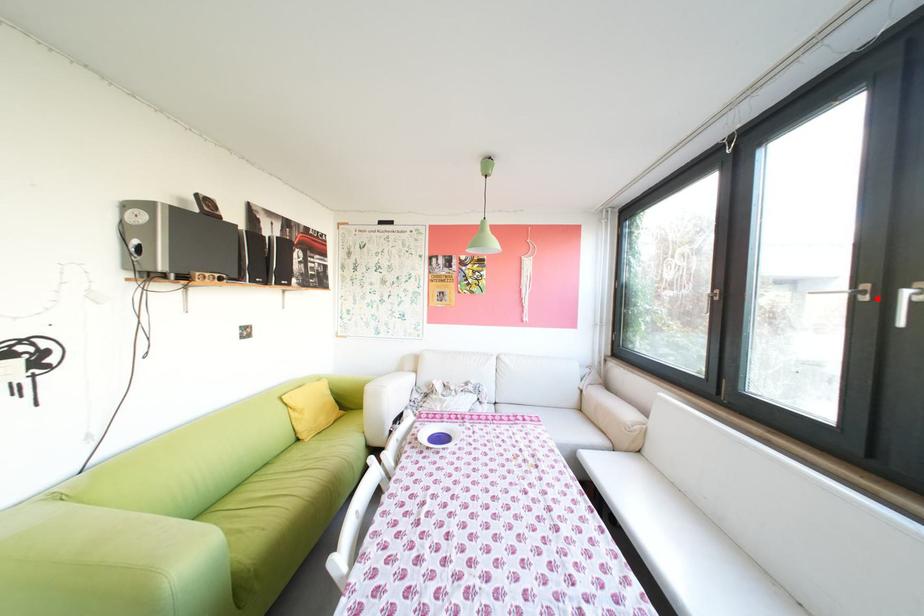
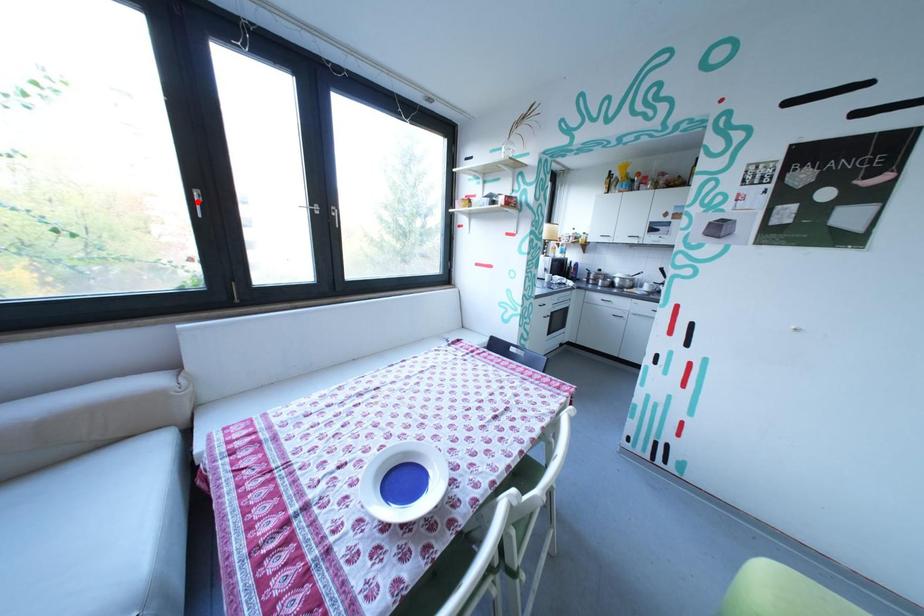
I am providing you with two images of the same scene from different viewpoints. A red point is marked on the first image and another point is marked on the second image. Are the points marked in image1 and image2 representing the same 3D position?

No